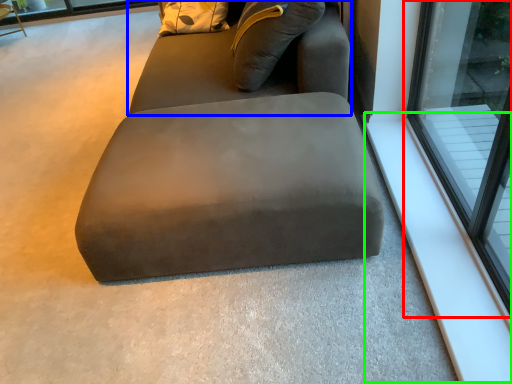
Question: Which is farther away from window (highlighted by a red box)? bean bag chair (highlighted by a blue box) or window sill (highlighted by a green box)?

Choices:
 (A) bean bag chair
 (B) window sill

Answer: (A)